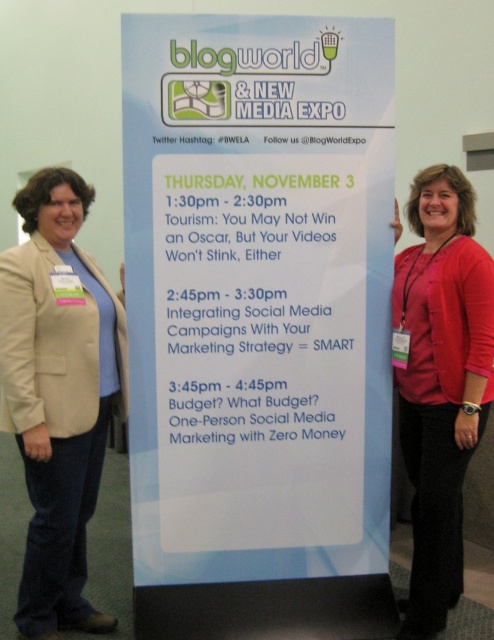
Question: Observing the image, what is the correct spatial positioning of white paper sign at center in reference to red matte shirt at center?

Choices:
 (A) right
 (B) left

Answer: (B)

Question: Which point is closer to the camera?

Choices:
 (A) (271, 460)
 (B) (394, 305)
 (C) (54, 188)

Answer: (C)

Question: Which of the following is the closest to the observer?

Choices:
 (A) (453, 289)
 (B) (40, 442)
 (C) (203, 435)

Answer: (B)

Question: Is beige fabric blazer at left positioned in front of red matte shirt at center?

Choices:
 (A) yes
 (B) no

Answer: (A)

Question: Can you confirm if white paper sign at center is thinner than red matte shirt at center?

Choices:
 (A) yes
 (B) no

Answer: (B)

Question: Which object is the farthest from the beige fabric blazer at left?

Choices:
 (A) red matte shirt at center
 (B) white paper sign at center

Answer: (A)